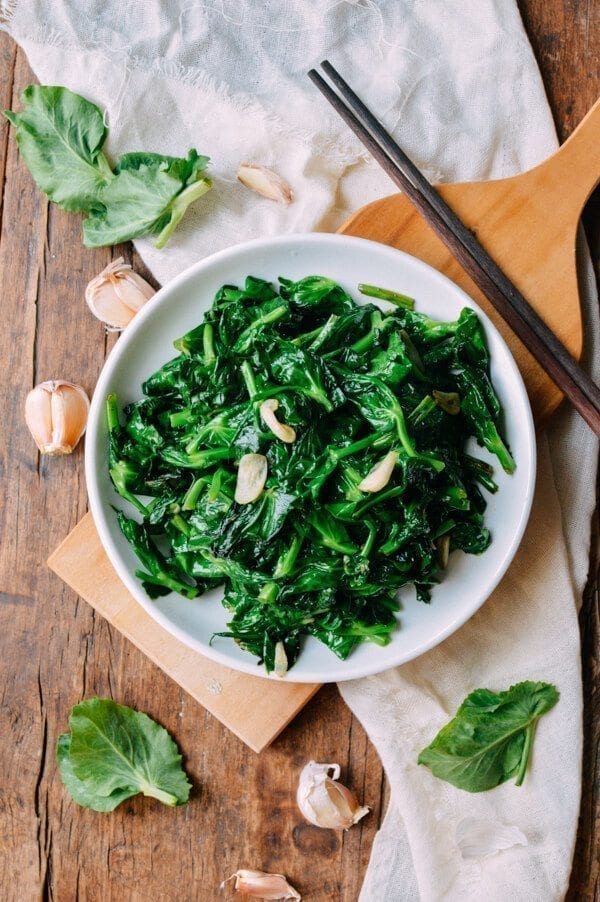
Locate an element on the screen. This screenshot has width=600, height=902. chopstick is located at coordinates (525, 305), (511, 320).